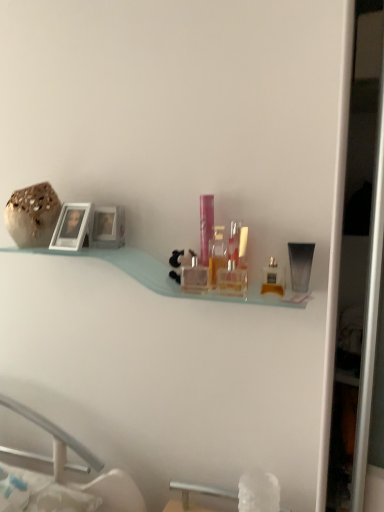
Question: Is pink plastic container at center, which is the seventh toiletry from right to left, to the left of clear glass perfume bottle at center, which is the fifth toiletry from right to left, from the viewer's perspective?

Choices:
 (A) no
 (B) yes

Answer: (B)

Question: Is pink plastic container at center, which is the 2th toiletry in left-to-right order, in front of clear glass perfume bottle at center, which is the fifth toiletry from right to left?

Choices:
 (A) yes
 (B) no

Answer: (B)

Question: Is pink plastic container at center, which is the 2th toiletry in left-to-right order, completely or partially outside of clear glass perfume bottle at center, which is the fifth toiletry from right to left?

Choices:
 (A) no
 (B) yes

Answer: (B)

Question: Can you confirm if pink plastic container at center, which is the seventh toiletry from right to left, is wider than clear glass perfume bottle at center, which is the 4th toiletry in left-to-right order?

Choices:
 (A) no
 (B) yes

Answer: (A)

Question: Is pink plastic container at center, which is the 2th toiletry in left-to-right order, shorter than clear glass perfume bottle at center, which is the 4th toiletry in left-to-right order?

Choices:
 (A) no
 (B) yes

Answer: (A)

Question: From a real-world perspective, is speckled ceramic vase at upper left above or below translucent plastic bottle at center, which ranks as the 6th toiletry in left-to-right order?

Choices:
 (A) above
 (B) below

Answer: (A)

Question: Do you think speckled ceramic vase at upper left is within translucent plastic bottle at center, which appears as the 3th toiletry when viewed from the right, or outside of it?

Choices:
 (A) inside
 (B) outside

Answer: (B)

Question: In terms of height, does speckled ceramic vase at upper left look taller or shorter compared to translucent plastic bottle at center, which appears as the 3th toiletry when viewed from the right?

Choices:
 (A) tall
 (B) short

Answer: (A)

Question: Considering the positions of speckled ceramic vase at upper left and translucent plastic bottle at center, which ranks as the 6th toiletry in left-to-right order, in the image, is speckled ceramic vase at upper left wider or thinner than translucent plastic bottle at center, which ranks as the 6th toiletry in left-to-right order,?

Choices:
 (A) thin
 (B) wide

Answer: (B)

Question: From their relative heights in the image, would you say translucent plastic bottle at center, placed as the second toiletry when sorted from right to left, is taller or shorter than transparent plastic tube at right, the first toiletry when ordered from right to left?

Choices:
 (A) tall
 (B) short

Answer: (B)

Question: Considering the positions of translucent plastic bottle at center, acting as the seventh toiletry starting from the left, and transparent plastic tube at right, the first toiletry when ordered from right to left, in the image, is translucent plastic bottle at center, acting as the seventh toiletry starting from the left, bigger or smaller than transparent plastic tube at right, the first toiletry when ordered from right to left,?

Choices:
 (A) big
 (B) small

Answer: (B)

Question: Relative to transparent plastic tube at right, the first toiletry when ordered from right to left, is translucent plastic bottle at center, acting as the seventh toiletry starting from the left, in front or behind?

Choices:
 (A) front
 (B) behind

Answer: (A)

Question: Is translucent plastic bottle at center, acting as the seventh toiletry starting from the left, wider or thinner than transparent plastic tube at right, the first toiletry when ordered from right to left?

Choices:
 (A) wide
 (B) thin

Answer: (B)

Question: In terms of height, does transparent plastic tube at right, the first toiletry when ordered from right to left, look taller or shorter compared to clear glass perfume bottle at center, the first toiletry viewed from the left?

Choices:
 (A) short
 (B) tall

Answer: (B)

Question: Does point (291, 268) appear closer or farther from the camera than point (183, 281)?

Choices:
 (A) farther
 (B) closer

Answer: (B)